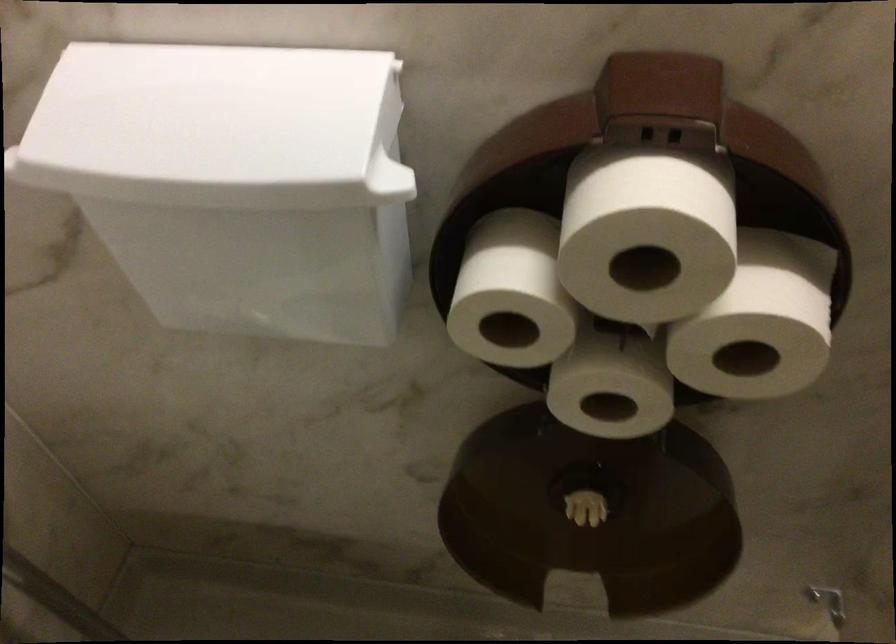
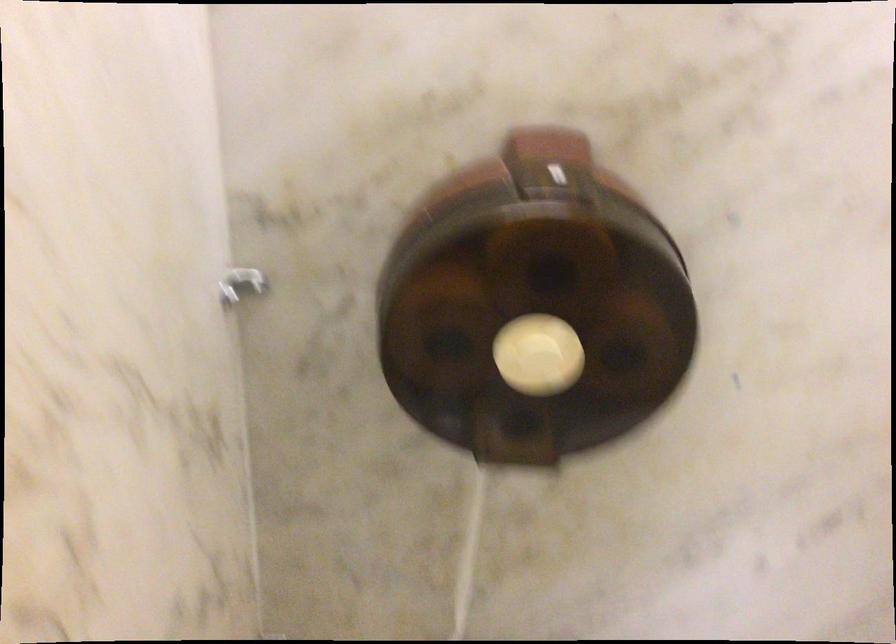
Question: The images are taken continuously from a first-person perspective. In which direction is your viewpoint rotating?

Choices:
 (A) Left
 (B) Right
 (C) Up
 (D) Down

Answer: (C)